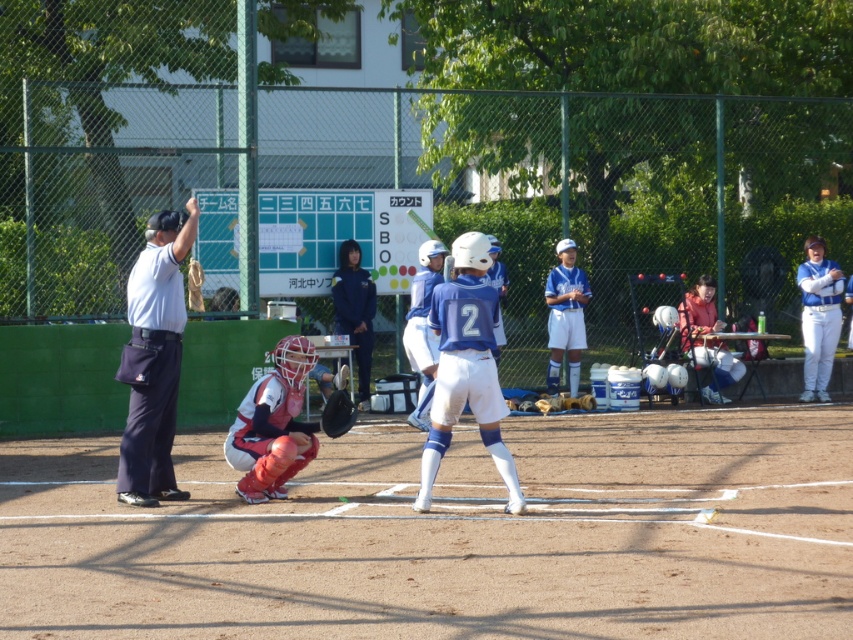
Who is more forward, [474,385] or [146,416]?

Point [474,385] is in front.

The width and height of the screenshot is (853, 640). Describe the element at coordinates (469, 365) in the screenshot. I see `blue uniform at center` at that location.

You are a GUI agent. You are given a task and a screenshot of the screen. Output one action in this format:
    pyautogui.click(x=<x>, y=<y>)
    Task: Click on the blue uniform at center
    
    Given the screenshot: What is the action you would take?
    pyautogui.click(x=469, y=365)

How distant is dark blue uniform at left from black leather baseball glove at center?

dark blue uniform at left and black leather baseball glove at center are 1.76 meters apart.

Can you confirm if dark blue uniform at left is positioned above black leather baseball glove at center?

Correct, dark blue uniform at left is located above black leather baseball glove at center.

Locate an element on the screen. dark blue uniform at left is located at coordinates (155, 358).

This screenshot has width=853, height=640. Find the location of `dark blue uniform at left`. dark blue uniform at left is located at coordinates pyautogui.click(x=155, y=358).

Is point (456, 328) positioned before point (254, 476)?

Yes, it is.

Does blue fabric uniform at center lie in front of matte red catcher at center?

That is True.

The image size is (853, 640). What are the coordinates of `blue fabric uniform at center` in the screenshot? It's located at (466, 368).